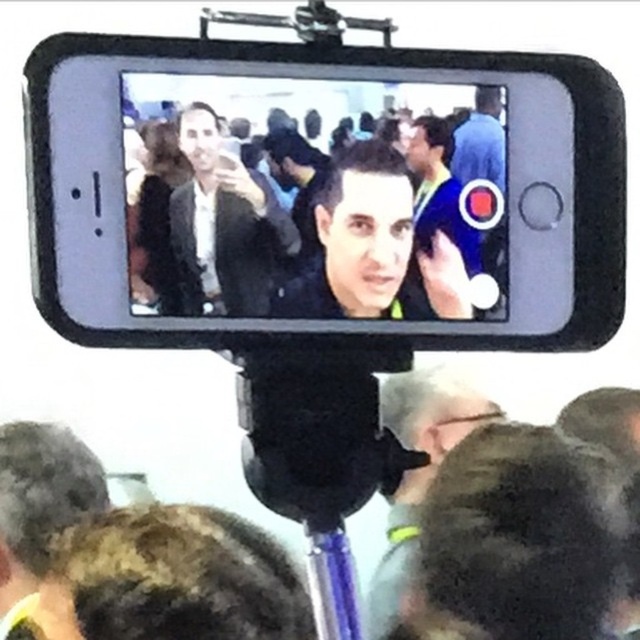
Is matte black phone at center further to the viewer compared to matte black suit at center?

Yes, it is behind matte black suit at center.

I want to click on matte black phone at center, so click(372, 246).

The height and width of the screenshot is (640, 640). I want to click on matte black phone at center, so click(x=372, y=246).

Which of these two, dark brown hair at lower left or dark gray fabric jacket at lower center, stands taller?

dark gray fabric jacket at lower center

Is dark brown hair at lower left taller than dark gray fabric jacket at lower center?

In fact, dark brown hair at lower left may be shorter than dark gray fabric jacket at lower center.

Is point (64, 467) farther from viewer compared to point (416, 387)?

No, it is not.

The height and width of the screenshot is (640, 640). I want to click on dark brown hair at lower left, so click(x=38, y=502).

Does matte black phone at center have a greater height compared to dark brown hair at lower left?

No.

Does matte black phone at center lie behind dark brown hair at lower left?

No, it is not.

Identify the location of matte black phone at center. The width and height of the screenshot is (640, 640). (372, 246).

The width and height of the screenshot is (640, 640). What are the coordinates of `matte black phone at center` in the screenshot? It's located at (372, 246).